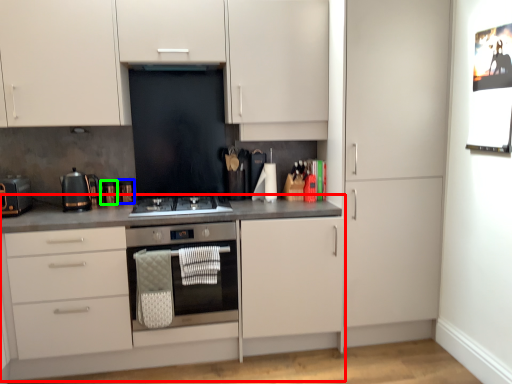
Question: Considering the real-world distances, which object is closest to countertop (highlighted by a red box)? appliance (highlighted by a blue box) or appliance (highlighted by a green box).

Choices:
 (A) appliance
 (B) appliance

Answer: (A)